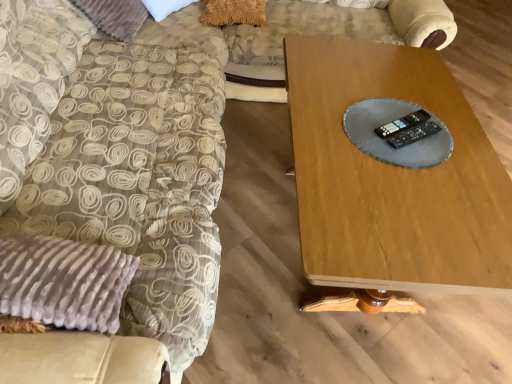
Find the location of a particular element. This screenshot has height=384, width=512. free area behind black plastic remote at center, which is the first control from bottom to top is located at coordinates (401, 105).